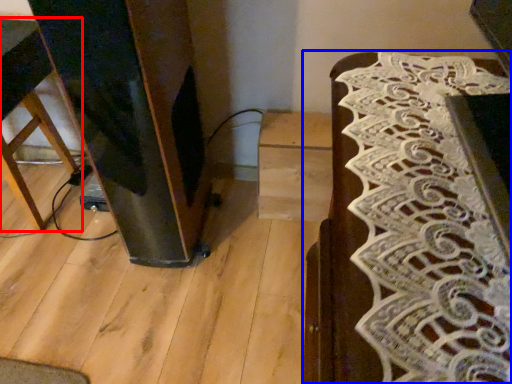
Question: Which object appears farthest to the camera in this image, furniture (highlighted by a red box) or furniture (highlighted by a blue box)?

Choices:
 (A) furniture
 (B) furniture

Answer: (A)